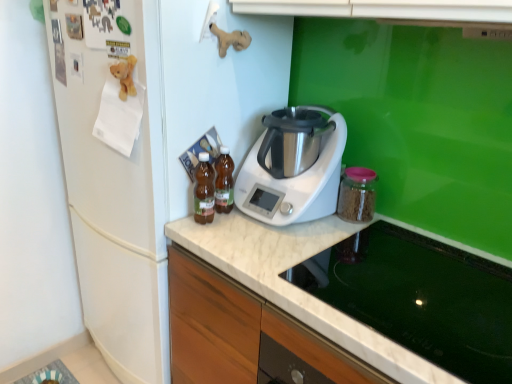
Where is `space that is in front of white plastic appliance at center, which is counted as the 2th kitchen appliance, starting from the right`? space that is in front of white plastic appliance at center, which is counted as the 2th kitchen appliance, starting from the right is located at coordinates (274, 247).